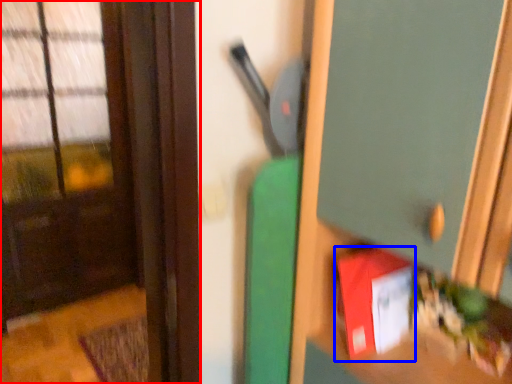
Question: Among these objects, which one is nearest to the camera, door (highlighted by a red box) or book (highlighted by a blue box)?

Choices:
 (A) door
 (B) book

Answer: (B)